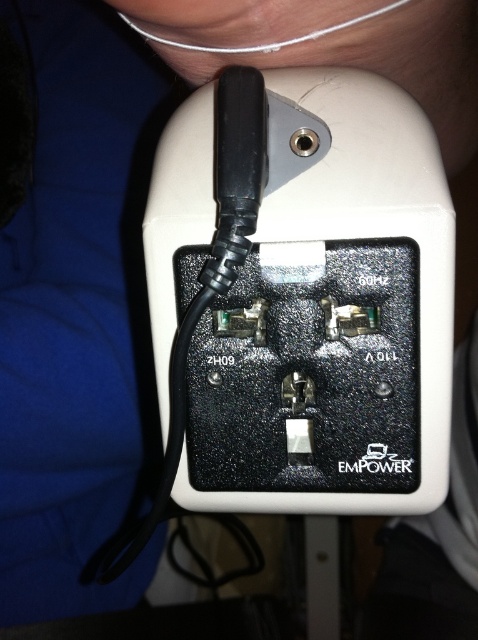
You are standing in front of the white power strip with a black cord. There is a point marked at coordinates (307, 298). What object is located at this point?

The black textured power outlet at center is located at point (307, 298).